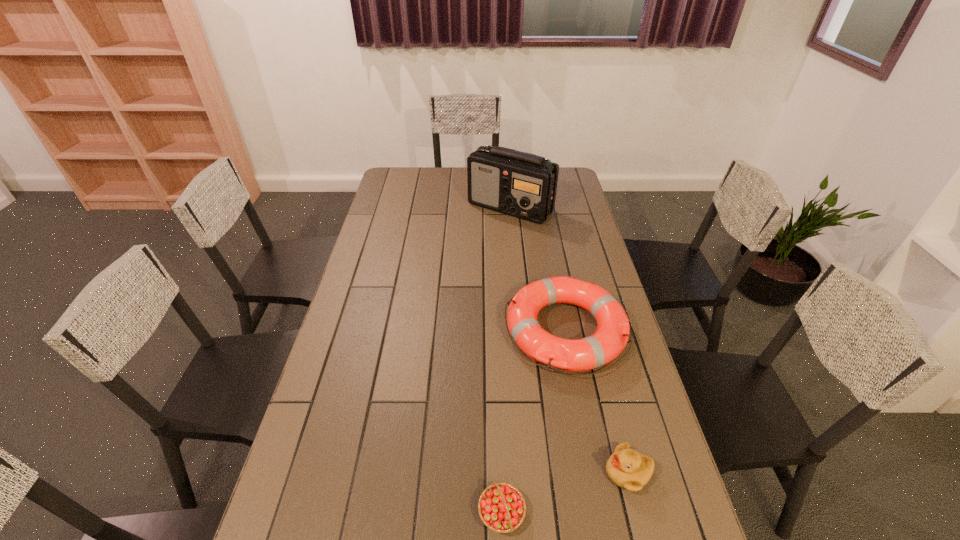
The image size is (960, 540). Identify the location of vacant space that is in between the radio receiver and the strawberry. (506, 360).

Locate an element on the screen. The height and width of the screenshot is (540, 960). empty space between the strawberry and the third nearest object is located at coordinates (534, 422).

The width and height of the screenshot is (960, 540). In order to click on empty space between the third nearest object and the radio receiver in this screenshot , I will do click(x=538, y=269).

I want to click on vacant space that's between the duckling and the life buoy, so click(x=596, y=402).

This screenshot has height=540, width=960. What are the coordinates of `unoccupied area between the strawberry and the duckling` in the screenshot? It's located at (564, 492).

The height and width of the screenshot is (540, 960). Identify the location of vacant space that is in between the strawberry and the duckling. (564, 492).

Identify the location of vacant space that's between the duckling and the strawberry. The width and height of the screenshot is (960, 540). (564, 492).

Where is `object that can be found as the closest to the duckling`? object that can be found as the closest to the duckling is located at coordinates (502, 508).

Locate which object ranks second in proximity to the tallest object. Please provide its 2D coordinates. Your answer should be formatted as a tuple, i.e. [(x, y)], where the tuple contains the x and y coordinates of a point satisfying the conditions above.

[(628, 469)]

This screenshot has height=540, width=960. I want to click on free location that satisfies the following two spatial constraints: 1. on the front panel of the second farthest object; 2. on the right side of the tallest object, so click(x=522, y=330).